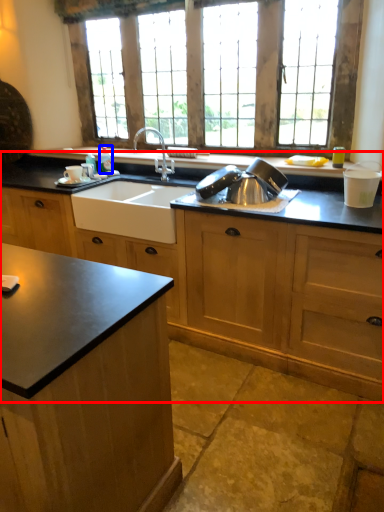
Question: Which object is further to the camera taking this photo, cabinetry (highlighted by a red box) or bottle (highlighted by a blue box)?

Choices:
 (A) cabinetry
 (B) bottle

Answer: (B)